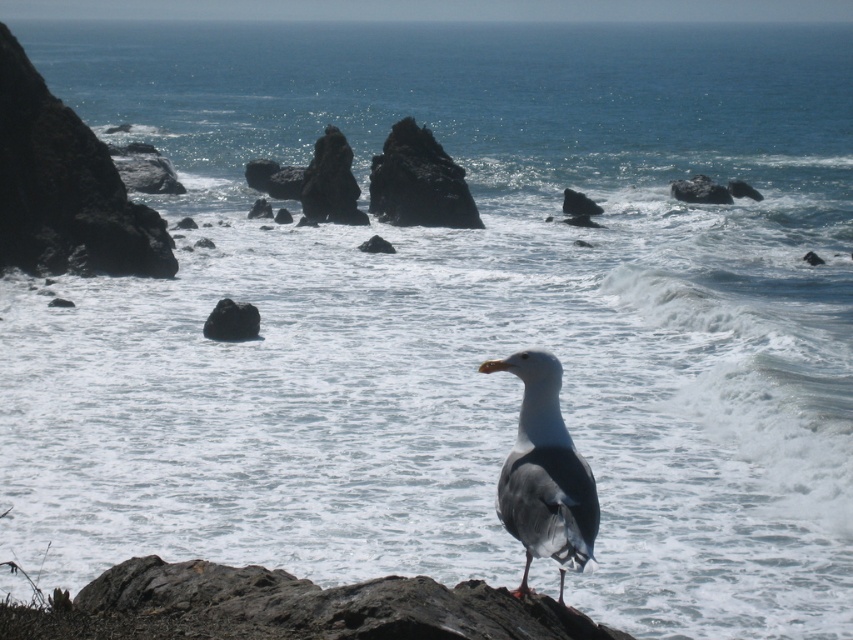
You are a photographer trying to capture the seagull in the image. The seagull is located at point (544, 474). If you want to frame the seagull in the center of your shot, which part of the image should you focus on?

The gray matte seagull at center is located at point (544, 474), so you should focus on the center of the image to frame the seagull properly.

You are a birdwatcher who wants to take a photo of the gray matte seagull at center and the rough textured rock at center in the same frame. Your camera has a maximum focus range of 70 feet. Can you capture both objects in focus without moving your position?

The gray matte seagull at center and rough textured rock at center are 78.98 feet apart from each other. Since the distance exceeds the camera maximum focus range of 70 feet, you cannot capture both objects in focus without moving your position.